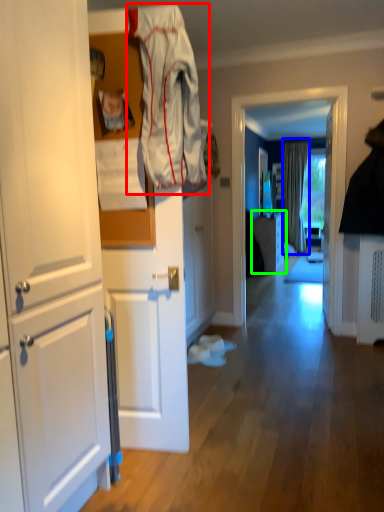
Question: Considering the real-world distances, which object is farthest from clothing (highlighted by a red box)? curtain (highlighted by a blue box) or cabinetry (highlighted by a green box)?

Choices:
 (A) curtain
 (B) cabinetry

Answer: (A)